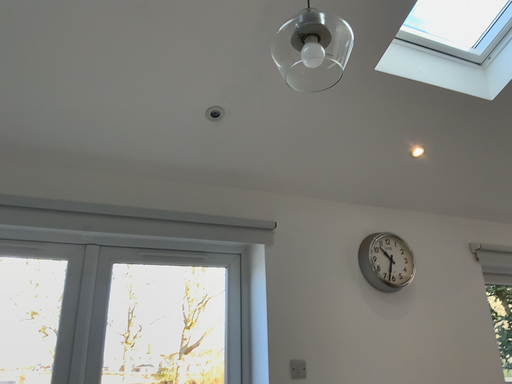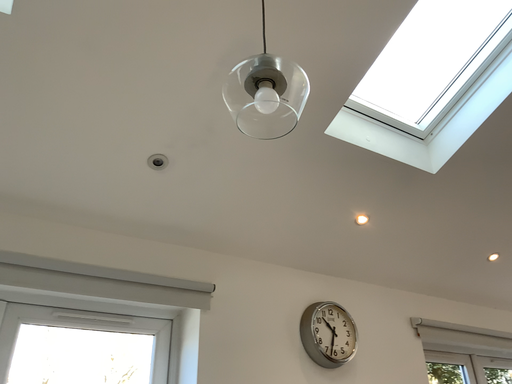
Question: Which way did the camera rotate in the video?

Choices:
 (A) rotated right
 (B) rotated left

Answer: (A)